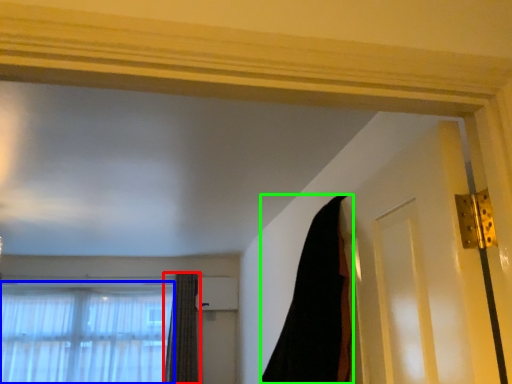
Question: Which object is the farthest from curtain (highlighted by a red box)? Choose among these: window (highlighted by a blue box) or curtain (highlighted by a green box).

Choices:
 (A) window
 (B) curtain

Answer: (B)